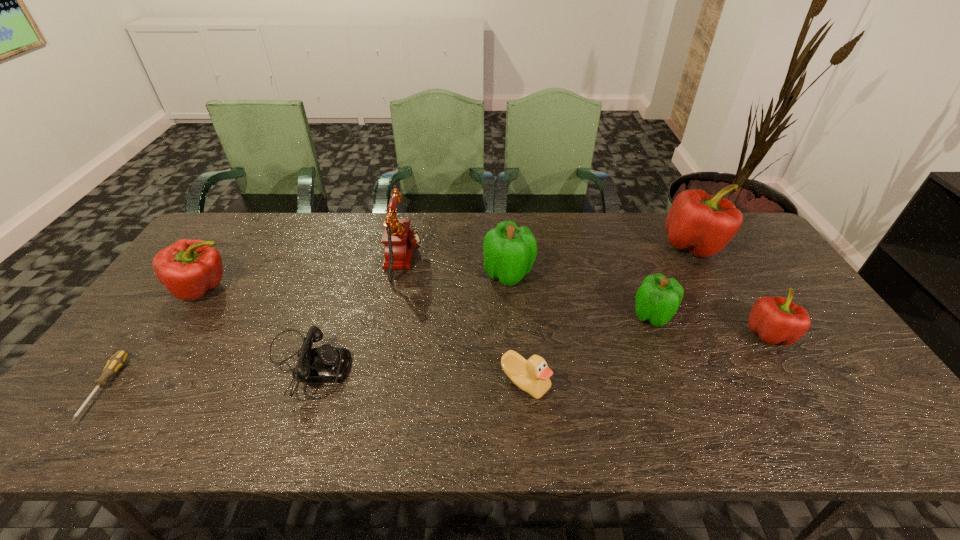
This screenshot has width=960, height=540. I want to click on free space located 0.310m on the back of the nearest pink bell pepper, so click(713, 248).

This screenshot has width=960, height=540. Identify the location of blank area located at the beak of the duck. (530, 431).

Locate an element on the screen. vacant space situated 0.180m on the front-facing side of the nearer telephone is located at coordinates tap(422, 366).

Where is `bell pepper present at the far edge`? bell pepper present at the far edge is located at coordinates (703, 224).

Identify the location of telephone present at the far edge. Image resolution: width=960 pixels, height=540 pixels. [x=399, y=240].

At what (x,y) coordinates should I click in order to perform the action: click on object present at the near edge. Please return your answer as a coordinate pair (x, y). The width and height of the screenshot is (960, 540). Looking at the image, I should click on (117, 361).

The image size is (960, 540). In order to click on bell pepper at the left edge in this screenshot , I will do tap(188, 268).

This screenshot has height=540, width=960. I want to click on screwdriver that is at the left edge, so click(117, 361).

Image resolution: width=960 pixels, height=540 pixels. In order to click on object present at the near left corner in this screenshot , I will do `click(117, 361)`.

I want to click on object located at the far right corner, so click(x=703, y=224).